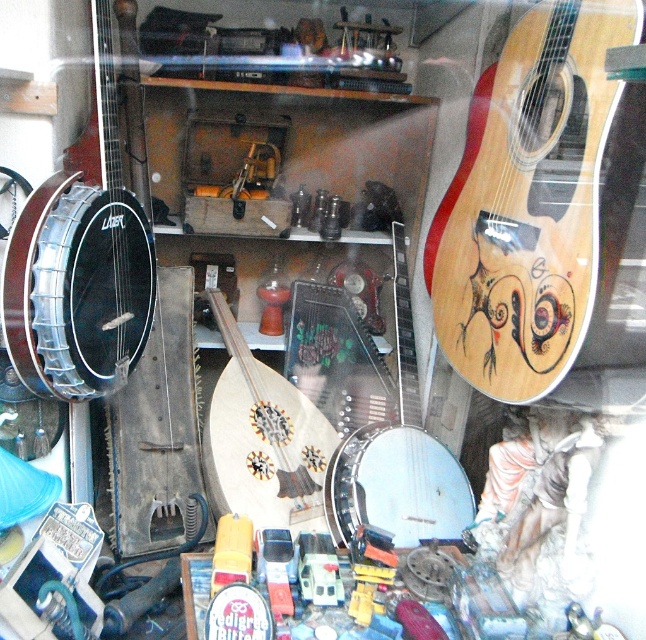
You are a customer in a music store and want to choose between the matte black banjo at left and the white matte banjo at center. Which one is bigger?

The white matte banjo at center is bigger than the matte black banjo at left.

You are a customer in the shop looking at the display. You see the wooden acoustic guitar at upper right and the matte black banjo at left. Which instrument is positioned lower in the display?

The wooden acoustic guitar at upper right is located below the matte black banjo at left, so it is positioned lower in the display.